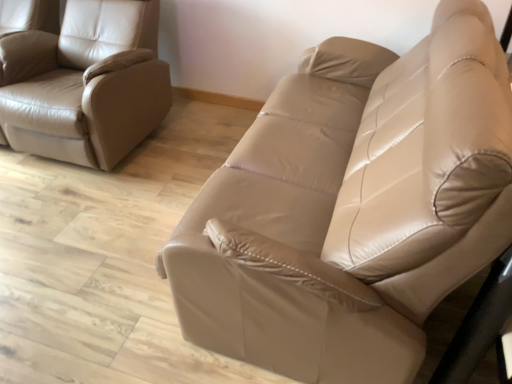
Question: Looking at the image, does matte leather chair at left seem bigger or smaller compared to matte leather couch at center?

Choices:
 (A) small
 (B) big

Answer: (A)

Question: From a real-world perspective, is matte leather chair at left positioned above or below matte leather couch at center?

Choices:
 (A) below
 (B) above

Answer: (A)

Question: Does point (52, 117) appear closer or farther from the camera than point (239, 319)?

Choices:
 (A) closer
 (B) farther

Answer: (B)

Question: Looking at the image, does matte leather couch at center seem bigger or smaller compared to matte leather chair at left?

Choices:
 (A) big
 (B) small

Answer: (A)

Question: In terms of width, does matte leather couch at center look wider or thinner when compared to matte leather chair at left?

Choices:
 (A) wide
 (B) thin

Answer: (A)

Question: In the image, is matte leather couch at center positioned in front of or behind matte leather chair at left?

Choices:
 (A) behind
 (B) front

Answer: (B)

Question: In terms of height, does matte leather couch at center look taller or shorter compared to matte leather chair at left?

Choices:
 (A) tall
 (B) short

Answer: (A)